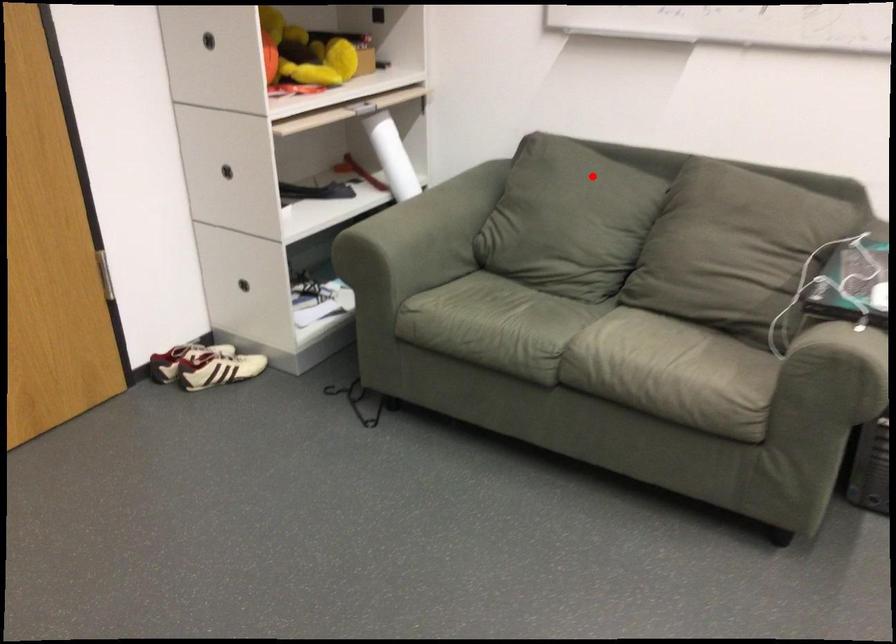
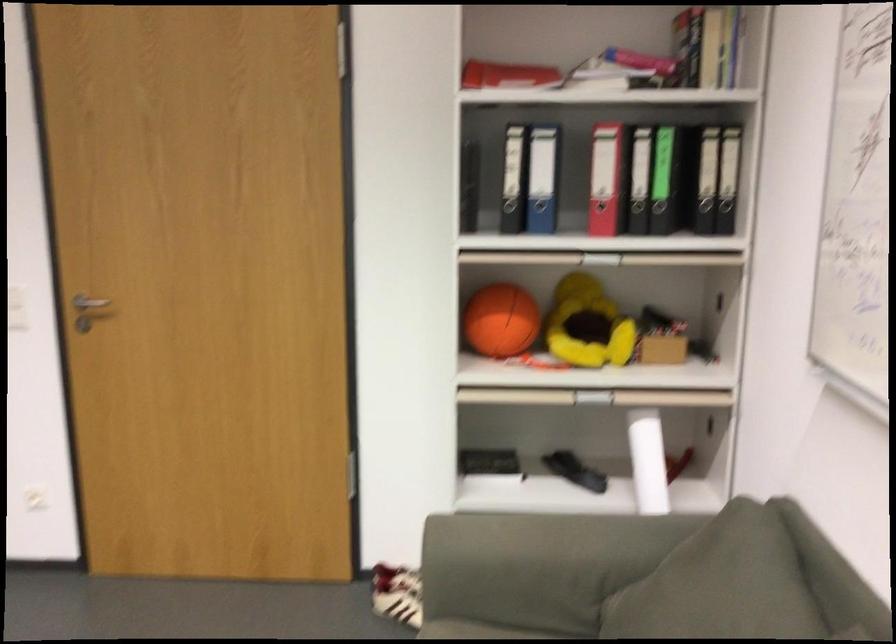
Question: I am providing you with two images of the same scene from different viewpoints. Image1 has a red point marked. In image2, the corresponding 3D location appears at what relative position? Reply with the corresponding letter.

Choices:
 (A) Closer
 (B) Farther

Answer: (A)